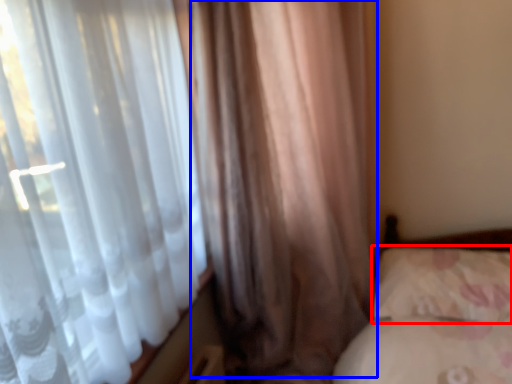
Question: Which object is closer to the camera taking this photo, pillow (highlighted by a red box) or curtain (highlighted by a blue box)?

Choices:
 (A) pillow
 (B) curtain

Answer: (B)